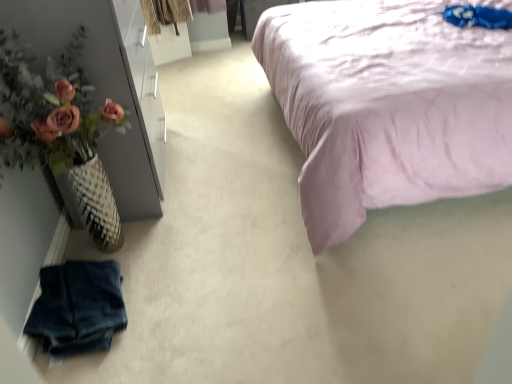
Locate an element on the screen. vacant area that is situated to the right of faded denim shorts at lower left is located at coordinates (177, 303).